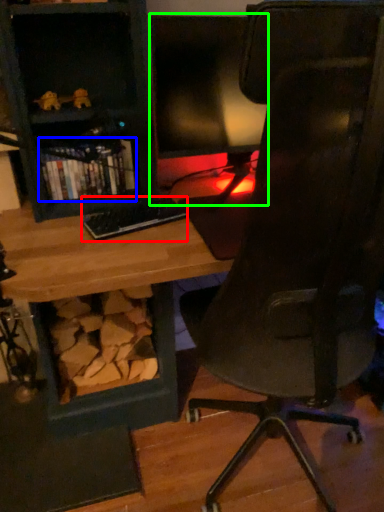
Question: Which object is the closest to the keyboard (highlighted by a red box)? Choose among these: book (highlighted by a blue box) or computer monitor (highlighted by a green box).

Choices:
 (A) book
 (B) computer monitor

Answer: (A)